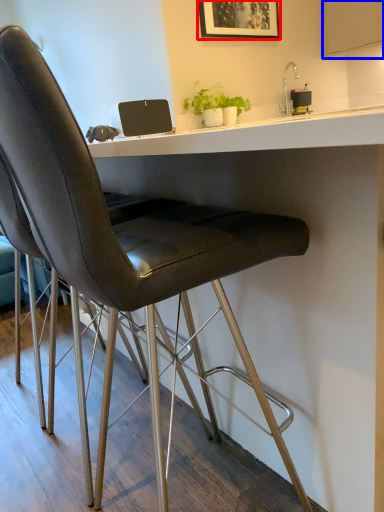
Question: Among these objects, which one is farthest to the camera, picture frame (highlighted by a red box) or cabinetry (highlighted by a blue box)?

Choices:
 (A) picture frame
 (B) cabinetry

Answer: (B)